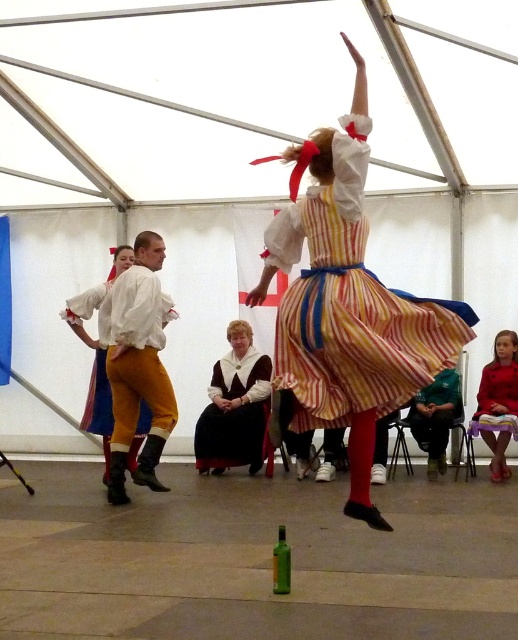
Consider the image. You are a photographer at the event and need to position yourself to capture both the striped cotton dress at center and the velvet brown dress at center in the same frame. Based on their positions, which dress should you focus on first to ensure both are in the shot?

You should focus on the velvet brown dress at center first since the striped cotton dress at center is to the right of it, allowing you to adjust your frame to include both dresses by expanding to the right.

You are standing at the entrance of the tent and see the point marked at coordinates (350, 307). Based on the scene description, can you identify which object this point is located on?

The point marked at coordinates (350, 307) is located on the striped cotton dress at center.